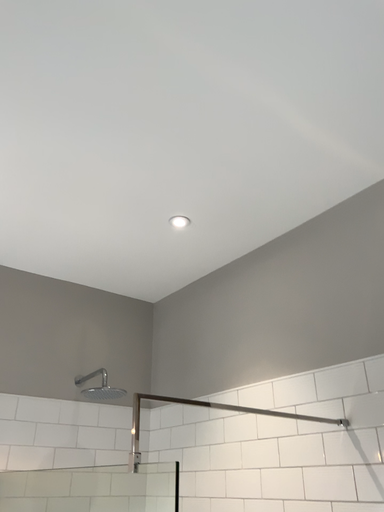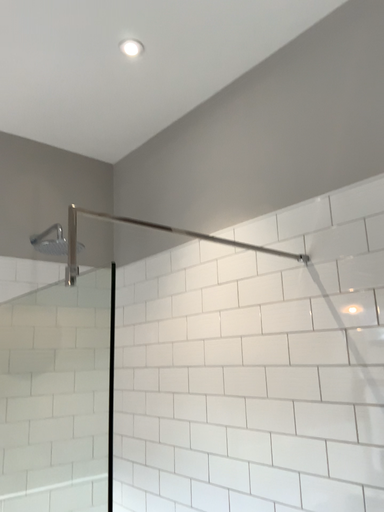
Question: Which way did the camera rotate in the video?

Choices:
 (A) rotated upward
 (B) rotated downward

Answer: (B)